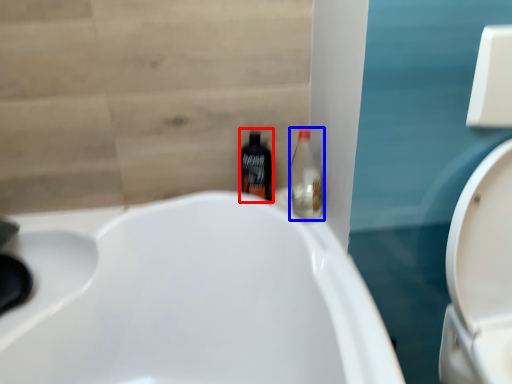
Question: Among these objects, which one is nearest to the camera, bottle (highlighted by a red box) or bottle (highlighted by a blue box)?

Choices:
 (A) bottle
 (B) bottle

Answer: (B)